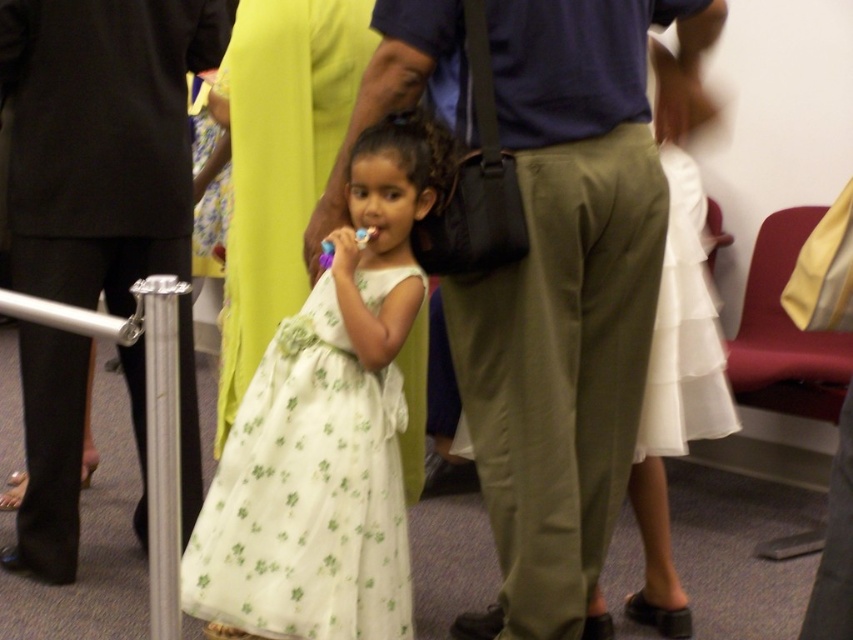
You are a dentist examining two toothbrushes in the center of the image. The purple plastic toothbrush at center and the matte plastic toothbrush at center. Which one is located to the left?

The purple plastic toothbrush at center is positioned on the left side of the matte plastic toothbrush at center.

You are a photographer trying to capture the best shot of the white floral dress at center. According to the coordinates provided, where should you position your camera to ensure the dress is centered in the frame?

The white floral dress at center is located at coordinates point (326, 429), so positioning the camera to center the frame at those coordinates would ensure the dress is centered.

Consider the image. You are a photographer trying to capture a closeup shot of the white satin dress at center. The camera you are using has a minimum focusing distance of 1.5 meters. Can you take the photo without moving the dress?

The white satin dress at center is 2.08 meters from camera, which is beyond the minimum focusing distance of 1.5 meters. Therefore, you can take the photo without moving the dress.